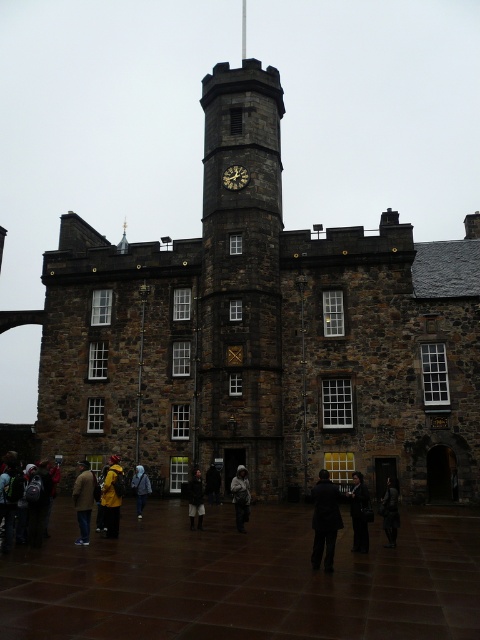
Question: Which of the following is the closest to the observer?

Choices:
 (A) yellow matte jacket at lower left
 (B) dark brown wooden clock at center

Answer: (A)

Question: Is the position of dark gray stone clock tower at center less distant than that of dark brown leather boots at center?

Choices:
 (A) no
 (B) yes

Answer: (A)

Question: Estimate the real-world distances between objects in this image. Which object is closer to the denim jacket at center?

Choices:
 (A) dark gray suit at center
 (B) dark brown leather jacket at lower left
 (C) yellow matte jacket at lower left

Answer: (C)

Question: Which of these objects is positioned closest to the dark brown leather boots at center?

Choices:
 (A) denim jacket at center
 (B) light brown leather jacket at center
 (C) dark gray stone clock tower at center

Answer: (B)

Question: Does yellow matte jacket at lower left lie in front of dark gray suit at center?

Choices:
 (A) yes
 (B) no

Answer: (B)

Question: Does denim jacket at center appear on the right side of dark brown wooden clock at center?

Choices:
 (A) no
 (B) yes

Answer: (A)